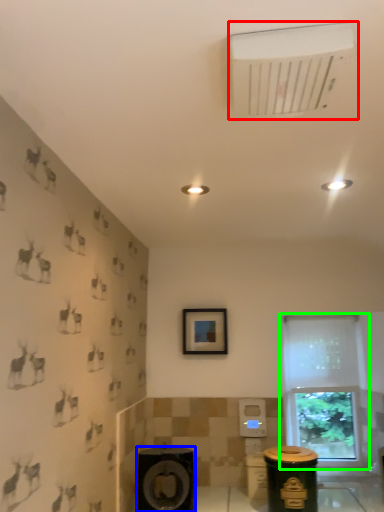
Question: Considering the real-world distances, which object is closest to air conditioning (highlighted by a red box)? speaker (highlighted by a blue box) or window (highlighted by a green box).

Choices:
 (A) speaker
 (B) window

Answer: (A)